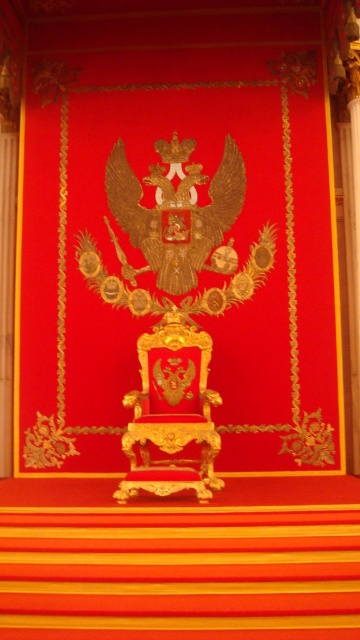
Can you confirm if gold/gilded eagle at center is positioned below goldmaterial/texturethrone at center?

Actually, gold/gilded eagle at center is above goldmaterial/texturethrone at center.

Between gold/gilded eagle at center and goldmaterial/texturethrone at center, which one is positioned lower?

goldmaterial/texturethrone at center is below.

Find the location of a particular element. The image size is (360, 640). gold/gilded eagle at center is located at coordinates (177, 212).